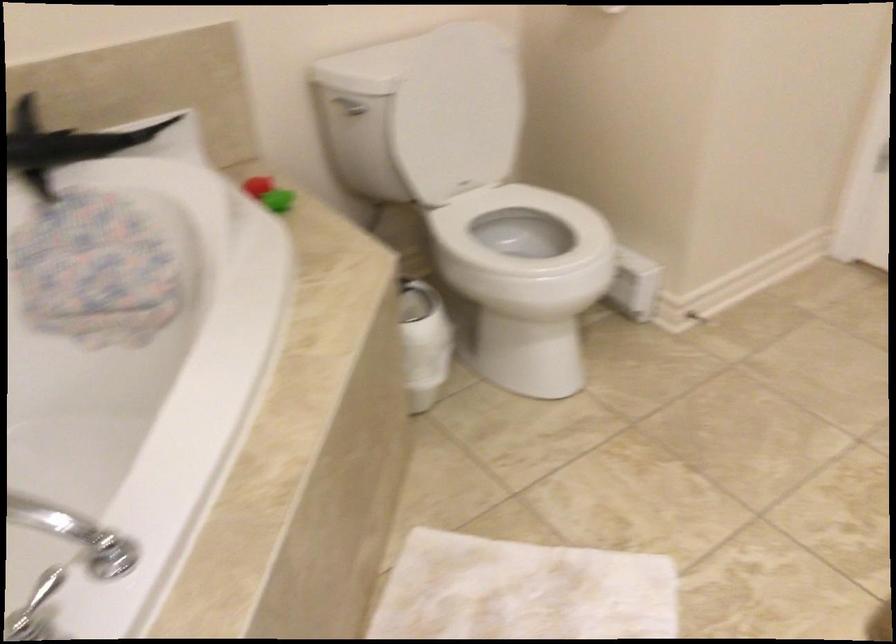
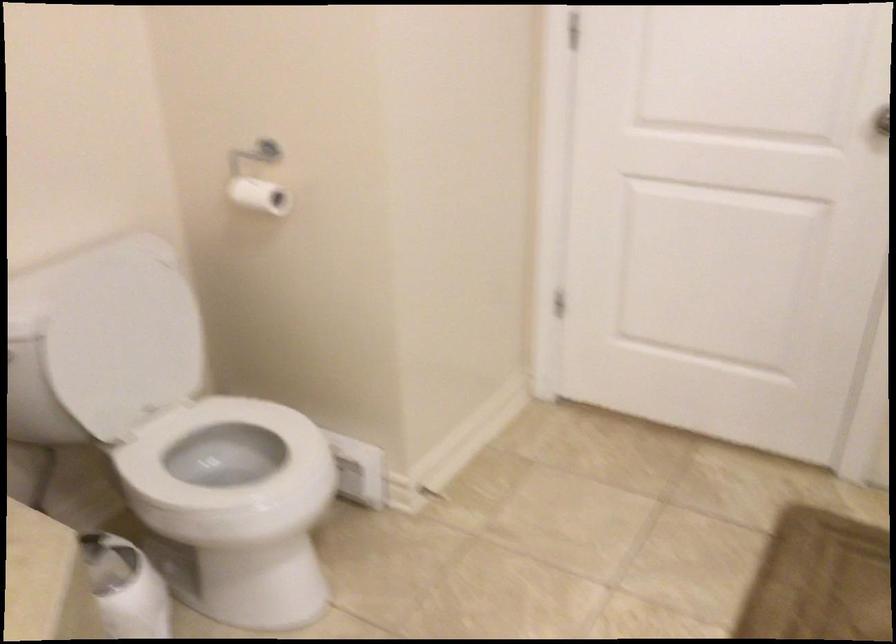
Find the pixel in the second image that matches the point at 449,122 in the first image.

(122, 346)